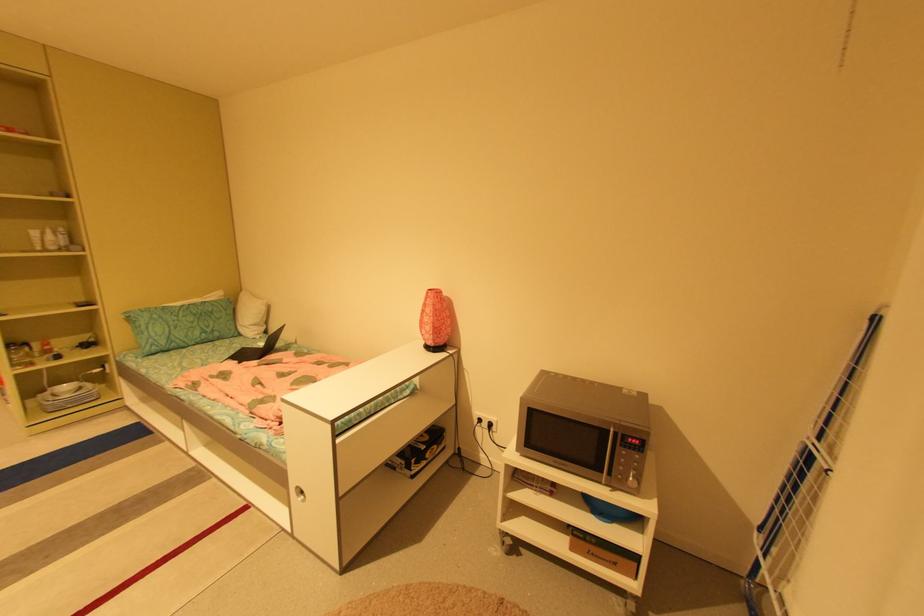
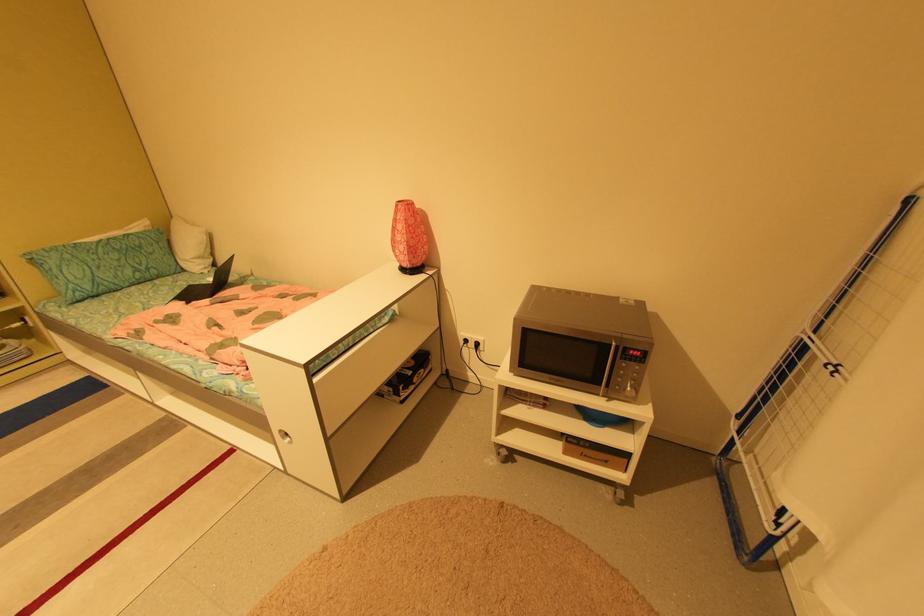
Locate, in the second image, the point that corresponds to point 261,347 in the first image.

(210, 284)